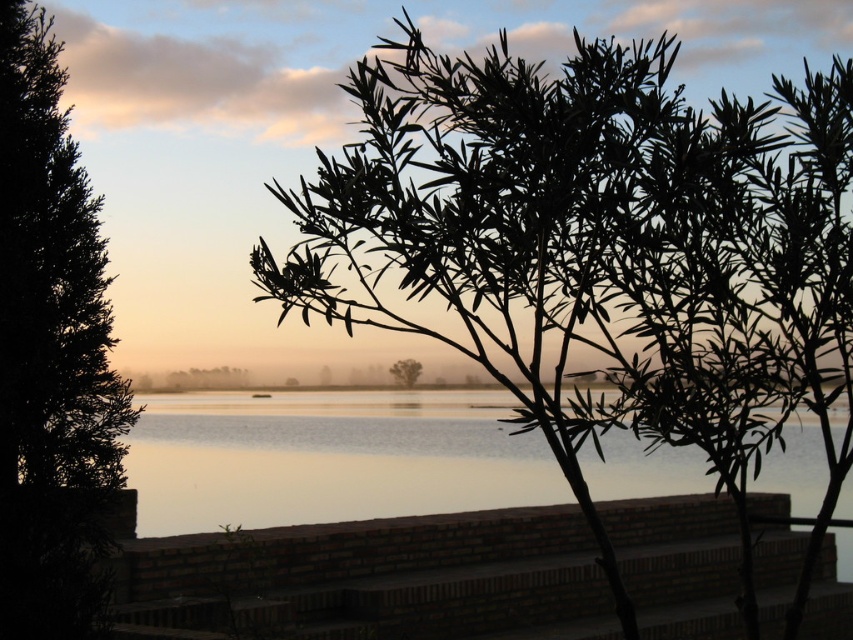
Question: Which object is the closest to the green leafy tree at center?

Choices:
 (A) silvery reflective water at center
 (B) green leafy tree at left
 (C) silhouette leafy branch at upper center

Answer: (A)

Question: Can you confirm if silhouette leafy branch at upper center is smaller than green leafy tree at center?

Choices:
 (A) yes
 (B) no

Answer: (B)

Question: Which point is closer to the camera taking this photo?

Choices:
 (A) (445, 276)
 (B) (73, 289)

Answer: (A)

Question: Which of the following is the closest to the observer?

Choices:
 (A) (491, 312)
 (B) (260, 408)
 (C) (404, 380)

Answer: (A)

Question: Is silhouette leafy branch at upper center positioned at the back of green leafy tree at center?

Choices:
 (A) no
 (B) yes

Answer: (A)

Question: Is green leafy tree at left positioned behind silvery reflective water at center?

Choices:
 (A) no
 (B) yes

Answer: (A)